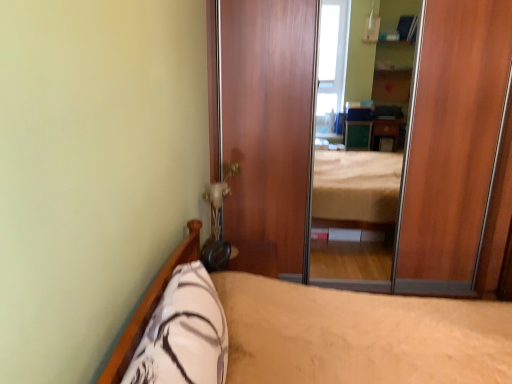
Question: Is beige fabric bed at lower left a part of white soft pillow at lower left?

Choices:
 (A) yes
 (B) no

Answer: (B)

Question: Does white soft pillow at lower left have a smaller size compared to beige fabric bed at lower left?

Choices:
 (A) yes
 (B) no

Answer: (A)

Question: Is beige fabric bed at lower left at the back of white soft pillow at lower left?

Choices:
 (A) no
 (B) yes

Answer: (B)

Question: Is white soft pillow at lower left next to beige fabric bed at lower left?

Choices:
 (A) yes
 (B) no

Answer: (B)

Question: From the image's perspective, would you say white soft pillow at lower left is shown under beige fabric bed at lower left?

Choices:
 (A) yes
 (B) no

Answer: (B)

Question: Does white soft pillow at lower left have a lesser width compared to beige fabric bed at lower left?

Choices:
 (A) yes
 (B) no

Answer: (A)

Question: Is beige fabric bed at lower left wider than wooden screen door at center?

Choices:
 (A) no
 (B) yes

Answer: (B)

Question: Is beige fabric bed at lower left closer to camera compared to wooden screen door at center?

Choices:
 (A) no
 (B) yes

Answer: (B)

Question: Does beige fabric bed at lower left have a lesser width compared to wooden screen door at center?

Choices:
 (A) no
 (B) yes

Answer: (A)

Question: Is beige fabric bed at lower left outside wooden screen door at center?

Choices:
 (A) no
 (B) yes

Answer: (B)

Question: Is beige fabric bed at lower left far away from wooden screen door at center?

Choices:
 (A) yes
 (B) no

Answer: (A)

Question: Does beige fabric bed at lower left appear on the right side of wooden screen door at center?

Choices:
 (A) yes
 (B) no

Answer: (B)

Question: Is wooden screen door at center not within white soft pillow at lower left?

Choices:
 (A) yes
 (B) no

Answer: (A)